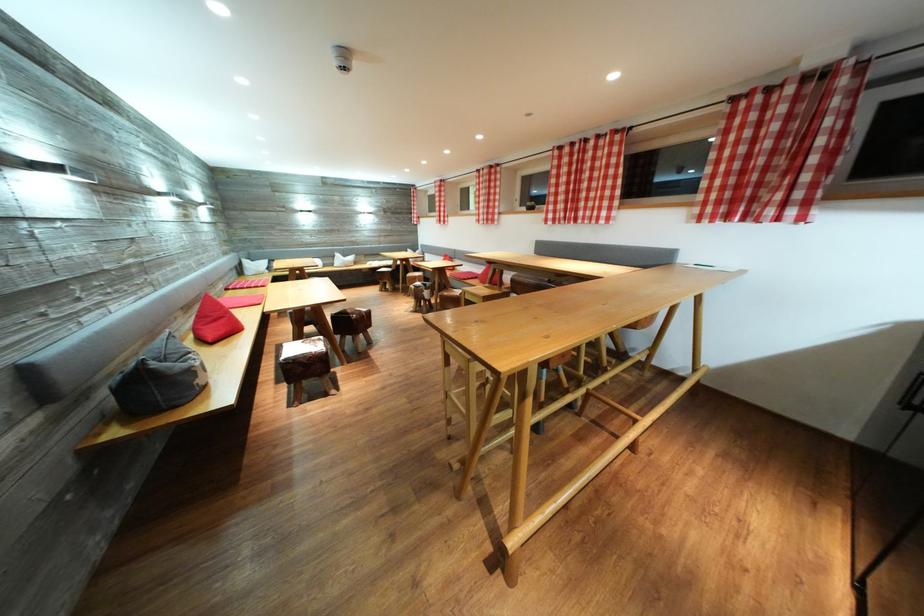
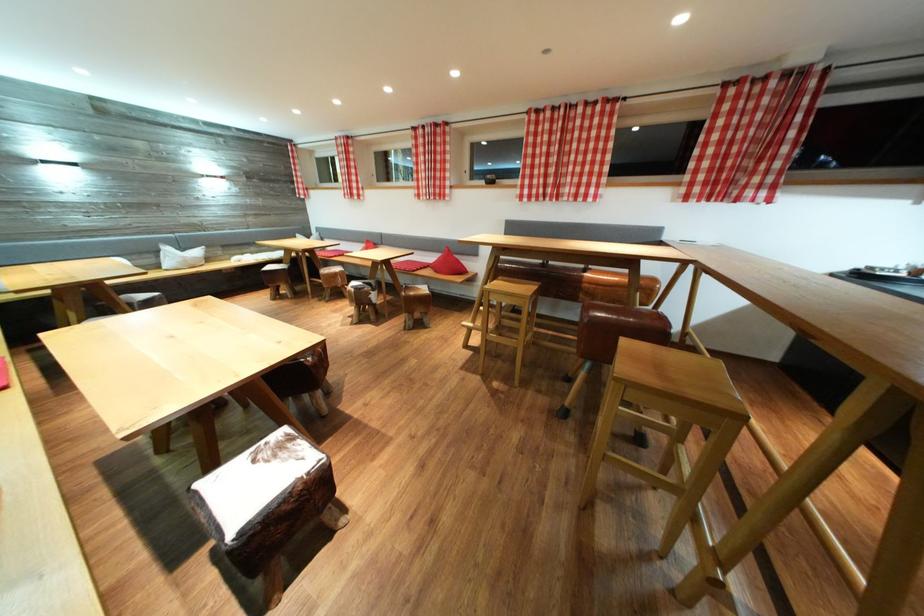
Locate, in the second image, the point that corresponds to pixel 334 262 in the first image.

(151, 259)